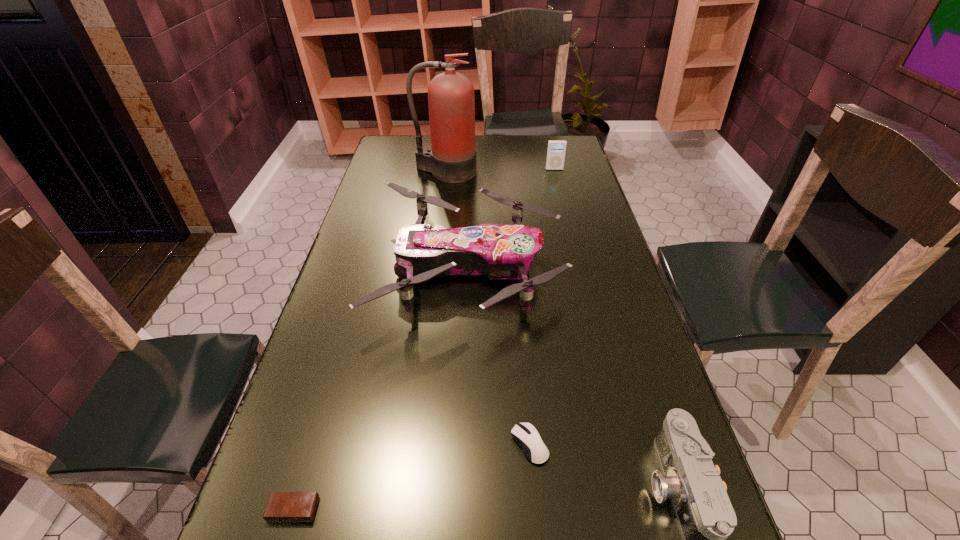
The height and width of the screenshot is (540, 960). In order to click on free space that satisfies the following two spatial constraints: 1. at the nozzle of the fire extinguisher; 2. on the left side of the second shortest object in this screenshot , I will do `click(413, 444)`.